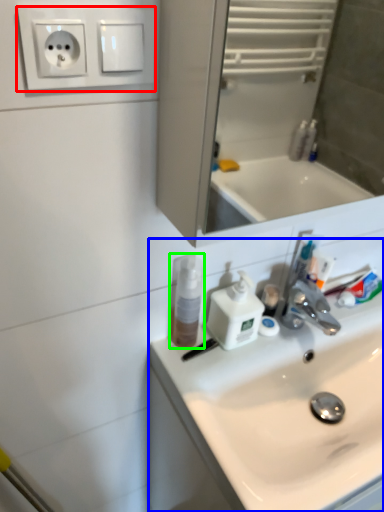
Question: Based on their relative distances, which object is farther from electric outlet (highlighted by a red box)? Choose from sink (highlighted by a blue box) and mouthwash (highlighted by a green box).

Choices:
 (A) sink
 (B) mouthwash

Answer: (A)